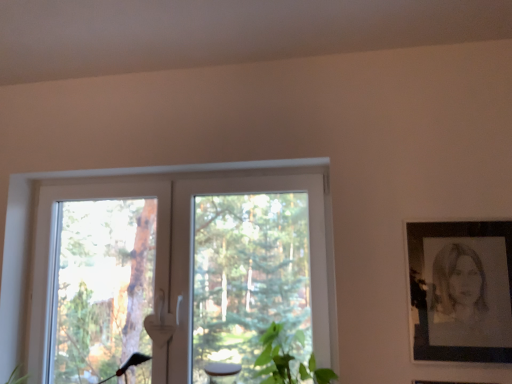
Question: Is there a large distance between black paper portrait at right and green leafy plant at lower center?

Choices:
 (A) yes
 (B) no

Answer: (B)

Question: Does black paper portrait at right appear on the left side of green leafy plant at lower center?

Choices:
 (A) no
 (B) yes

Answer: (A)

Question: Considering the relative sizes of black paper portrait at right and green leafy plant at lower center in the image provided, is black paper portrait at right thinner than green leafy plant at lower center?

Choices:
 (A) yes
 (B) no

Answer: (A)

Question: Is black paper portrait at right located outside green leafy plant at lower center?

Choices:
 (A) no
 (B) yes

Answer: (B)

Question: Is black paper portrait at right smaller than green leafy plant at lower center?

Choices:
 (A) yes
 (B) no

Answer: (A)

Question: Considering the positions of black paper portrait at right and white plastic window at center in the image, is black paper portrait at right taller or shorter than white plastic window at center?

Choices:
 (A) short
 (B) tall

Answer: (A)

Question: In the image, is black paper portrait at right positioned in front of or behind white plastic window at center?

Choices:
 (A) front
 (B) behind

Answer: (A)

Question: Based on their sizes in the image, would you say black paper portrait at right is bigger or smaller than white plastic window at center?

Choices:
 (A) big
 (B) small

Answer: (B)

Question: Is black paper portrait at right situated inside white plastic window at center or outside?

Choices:
 (A) outside
 (B) inside

Answer: (A)

Question: Does point (434, 266) appear closer or farther from the camera than point (294, 357)?

Choices:
 (A) farther
 (B) closer

Answer: (B)

Question: Based on their sizes in the image, would you say black paper portrait at right is bigger or smaller than green leafy plant at lower center?

Choices:
 (A) big
 (B) small

Answer: (B)

Question: Considering the positions of black paper portrait at right and green leafy plant at lower center in the image, is black paper portrait at right wider or thinner than green leafy plant at lower center?

Choices:
 (A) thin
 (B) wide

Answer: (A)

Question: Would you say black paper portrait at right is inside or outside green leafy plant at lower center?

Choices:
 (A) inside
 (B) outside

Answer: (B)

Question: Is point pyautogui.click(x=28, y=344) closer or farther from the camera than point pyautogui.click(x=415, y=266)?

Choices:
 (A) closer
 (B) farther

Answer: (B)

Question: Would you say white plastic window at center is to the left or to the right of black paper portrait at right in the picture?

Choices:
 (A) left
 (B) right

Answer: (A)